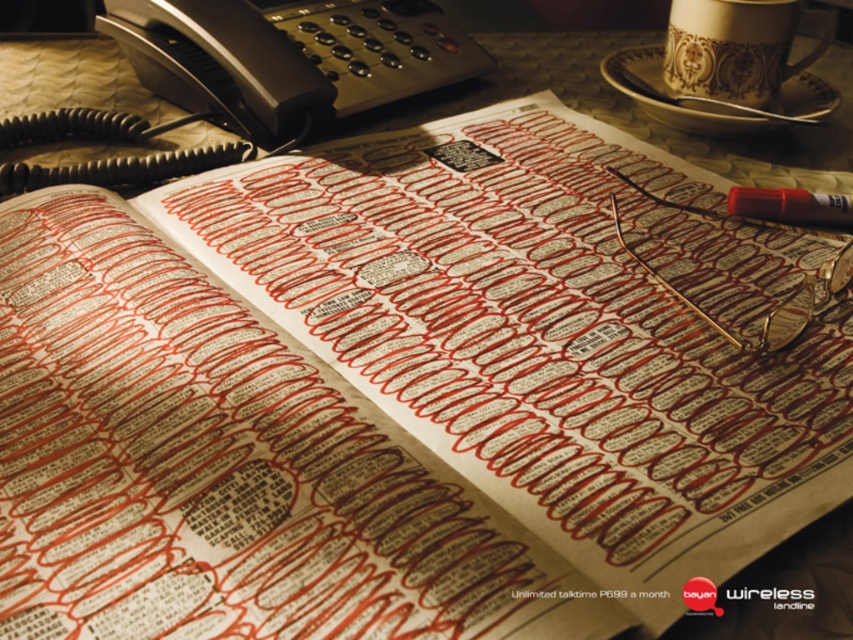
Question: Does black plastic phone at upper left lie in front of gold textured coffee cup at upper right?

Choices:
 (A) yes
 (B) no

Answer: (A)

Question: Estimate the real-world distances between objects in this image. Which object is closer to the translucent red pen at upper right?

Choices:
 (A) gold textured coffee cup at upper right
 (B) black plastic phone at upper left

Answer: (A)

Question: Among these objects, which one is nearest to the camera?

Choices:
 (A) black plastic phone at upper left
 (B) gold textured coffee cup at upper right

Answer: (A)

Question: Which of the following is the closest to the observer?

Choices:
 (A) (267, 125)
 (B) (688, 88)
 (C) (761, 196)

Answer: (C)

Question: Does black plastic phone at upper left have a larger size compared to gold textured coffee cup at upper right?

Choices:
 (A) no
 (B) yes

Answer: (B)

Question: Does black plastic phone at upper left have a smaller size compared to translucent red pen at upper right?

Choices:
 (A) yes
 (B) no

Answer: (B)